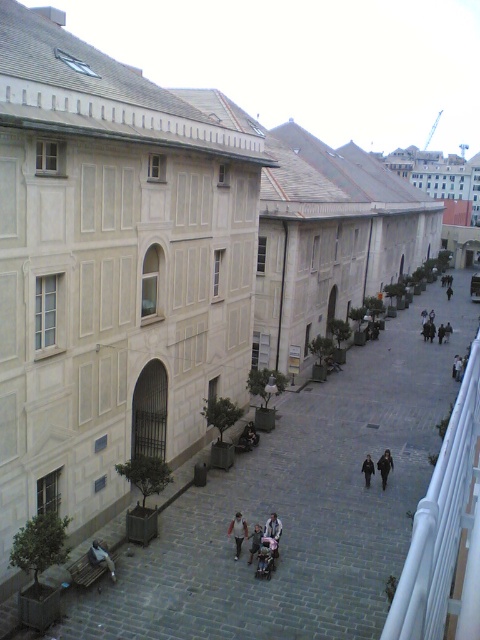
Consider the image. You are standing on the balcony looking down at the plaza. You see two dark gray coats. The first is labeled as a dark gray fabric coat at center and the second as a dark gray coat at lower center. Which of these two coats is located to the left when viewed from your perspective?

The dark gray fabric coat at center is positioned on the left side of the dark gray coat at lower center, so when viewed from your perspective on the balcony, the dark gray fabric coat at center is to the left.

You are standing on the balcony overlooking the plaza and notice two figures at the center. The dark gray fabric jacket at center and the black fabric person at center. Which one is positioned to the left when viewed from your perspective?

The dark gray fabric jacket at center is to the left of the black fabric person at center, so when viewed from your perspective on the balcony, the dark gray fabric jacket at center is positioned to the left.

You are observing a plaza from a balcony. You notice a dark gray fabric jacket at center and a black fabric person at center. Which object is shorter?

The dark gray fabric jacket at center is shorter than the black fabric person at center.